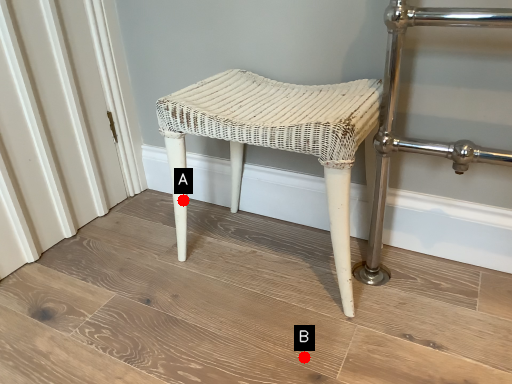
Question: Two points are circled on the image, labeled by A and B beside each circle. Which point is further to the camera?

Choices:
 (A) A is further
 (B) B is further

Answer: (A)